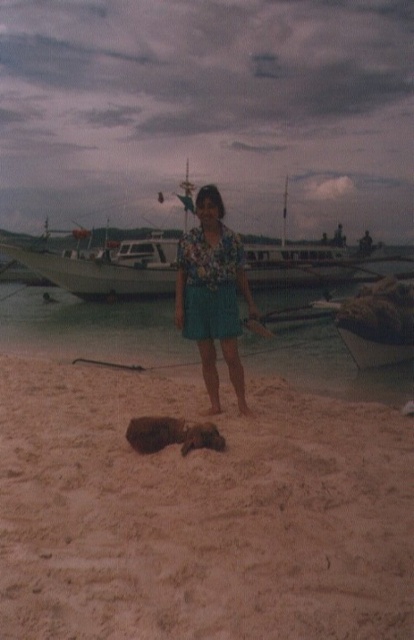
You are standing on the brown sandy beach at lower center and want to walk to the white wooden boat at center. Which direction should you walk to reach the boat?

You should walk upwards towards the white wooden boat at center since the brown sandy beach at lower center is positioned under it.

You are standing on the beach and see both the brown sandy beach at lower center and the sandy beach at center. Which one is positioned to the right side?

The brown sandy beach at lower center is positioned to the right of the sandy beach at center.